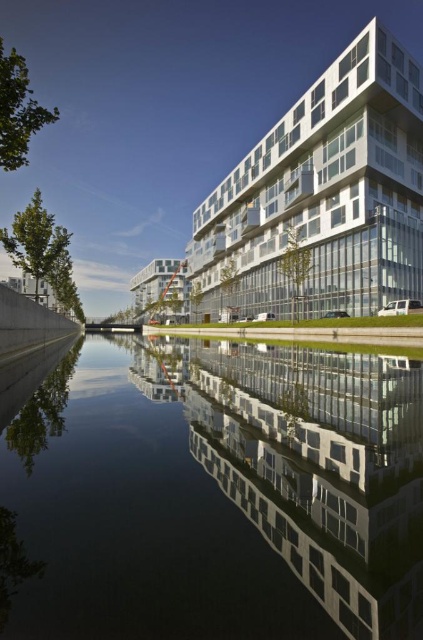
Question: Is transparent glass waterway at center below white glass building at upper center?

Choices:
 (A) no
 (B) yes

Answer: (B)

Question: Does transparent glass waterway at center lie in front of white glass building at upper center?

Choices:
 (A) yes
 (B) no

Answer: (A)

Question: Which of the following is the closest to the observer?

Choices:
 (A) (387, 636)
 (B) (343, 196)

Answer: (A)

Question: Among these objects, which one is nearest to the camera?

Choices:
 (A) transparent glass waterway at center
 (B) white glass building at upper center

Answer: (A)

Question: Can you confirm if transparent glass waterway at center is wider than white glass building at upper center?

Choices:
 (A) no
 (B) yes

Answer: (A)

Question: Which of the following is the closest to the observer?

Choices:
 (A) white glass building at upper center
 (B) transparent glass waterway at center

Answer: (B)